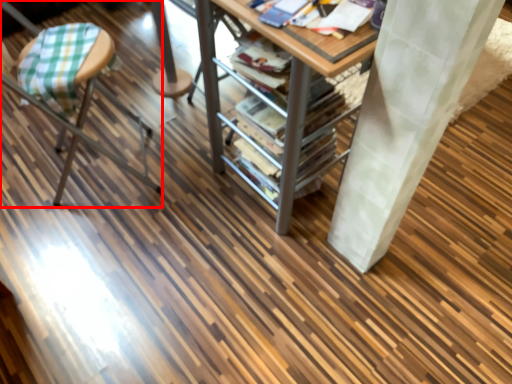
Question: Observing the image, what is the correct spatial positioning of furniture (annotated by the red box) in reference to table?

Choices:
 (A) left
 (B) right

Answer: (A)